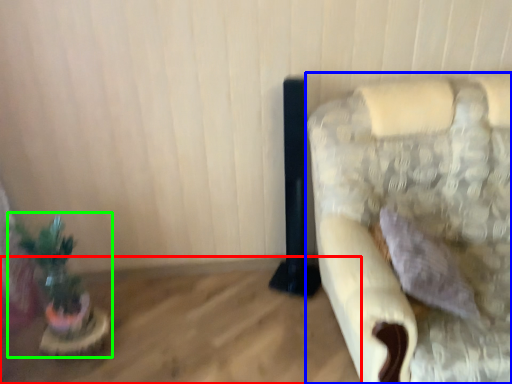
Question: Considering the real-world distances, which object is farthest from table (highlighted by a red box)? furniture (highlighted by a blue box) or houseplant (highlighted by a green box)?

Choices:
 (A) furniture
 (B) houseplant

Answer: (A)